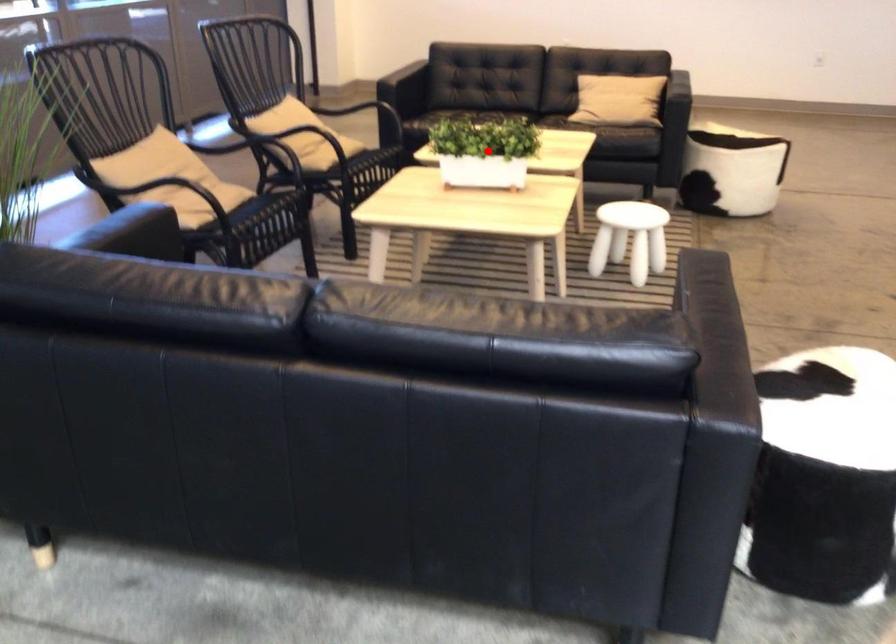
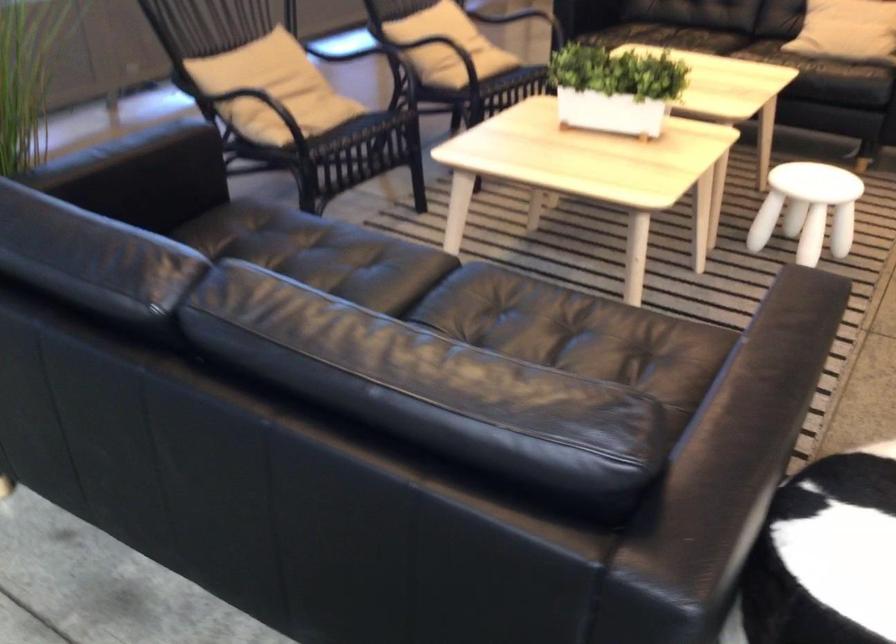
Find the pixel in the second image that matches the highlighted location in the first image.

(615, 88)